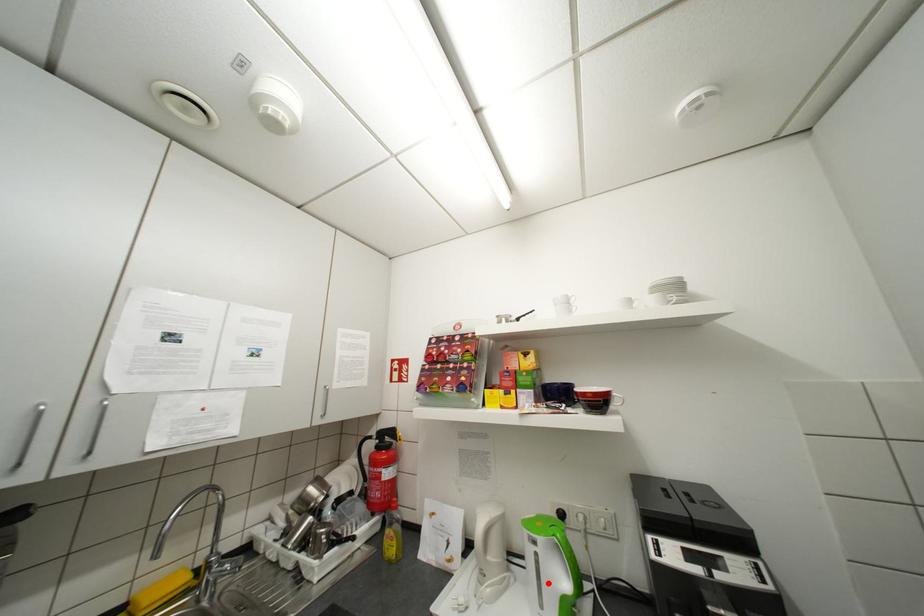
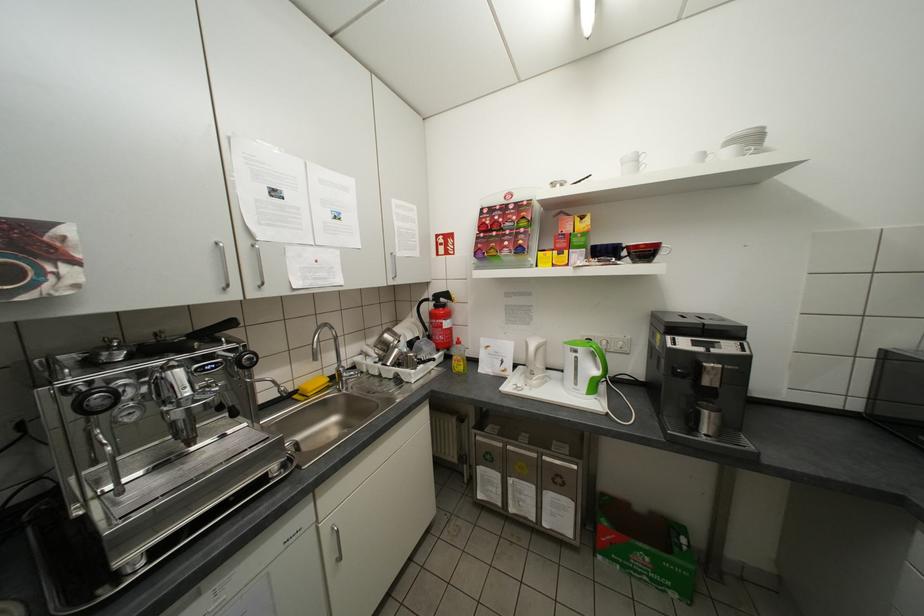
Question: I am providing you with two images of the same scene from different viewpoints. A red point is marked on the first image. Can you still see the location of the red point in image 2?

Choices:
 (A) Yes
 (B) No

Answer: (A)